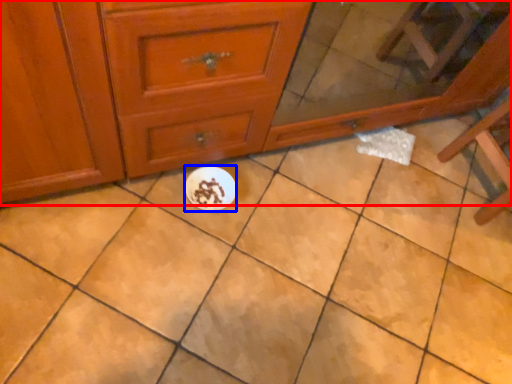
Question: Which point is closer to the camera, chest of drawers (highlighted by a red box) or paper plate (highlighted by a blue box)?

Choices:
 (A) chest of drawers
 (B) paper plate

Answer: (A)